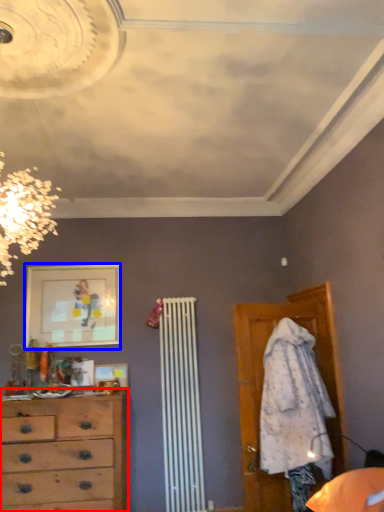
Question: Which of the following is the closest to the observer, chest of drawers (highlighted by a red box) or picture frame (highlighted by a blue box)?

Choices:
 (A) chest of drawers
 (B) picture frame

Answer: (A)